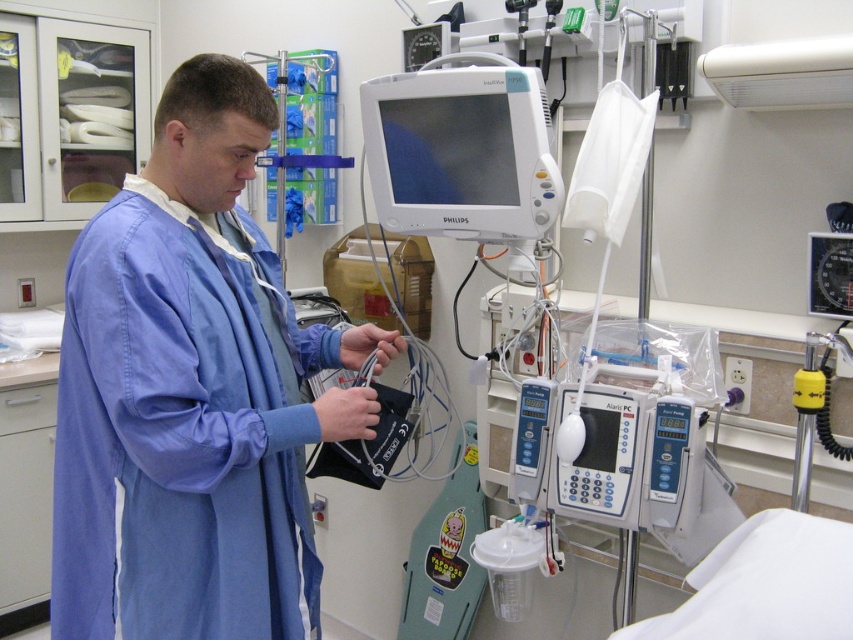
Question: Which of the following is the closest to the observer?

Choices:
 (A) green plastic bag at center
 (B) blue cotton gown at center

Answer: (B)

Question: Does white glossy monitor at center appear on the left side of green plastic bag at center?

Choices:
 (A) yes
 (B) no

Answer: (B)

Question: Does white glossy monitor at center appear on the left side of green plastic bag at center?

Choices:
 (A) yes
 (B) no

Answer: (B)

Question: Which object appears farthest from the camera in this image?

Choices:
 (A) white glossy monitor at center
 (B) green plastic bag at center

Answer: (B)

Question: Is white glossy monitor at center closer to the viewer compared to green plastic bag at center?

Choices:
 (A) yes
 (B) no

Answer: (A)

Question: Which point appears closest to the camera in this image?

Choices:
 (A) pyautogui.click(x=73, y=502)
 (B) pyautogui.click(x=514, y=131)

Answer: (A)